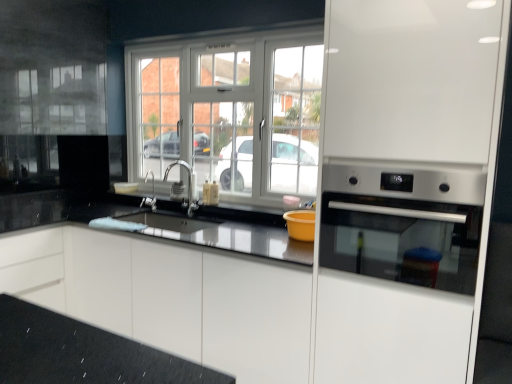
Question: Is white glossy cabinet at center further to the viewer compared to satin silver oven at right?

Choices:
 (A) yes
 (B) no

Answer: (A)

Question: From a real-world perspective, is white glossy cabinet at center physically below satin silver oven at right?

Choices:
 (A) yes
 (B) no

Answer: (A)

Question: Is white glossy cabinet at center at the left side of satin silver oven at right?

Choices:
 (A) yes
 (B) no

Answer: (A)

Question: From the image's perspective, would you say white glossy cabinet at center is shown under satin silver oven at right?

Choices:
 (A) yes
 (B) no

Answer: (A)

Question: Is white glossy cabinet at center directly adjacent to satin silver oven at right?

Choices:
 (A) no
 (B) yes

Answer: (A)

Question: Is white glossy cabinet at center completely or partially outside of satin silver oven at right?

Choices:
 (A) yes
 (B) no

Answer: (A)

Question: Is the depth of satin nickel faucet at center greater than that of stainless steel oven at right?

Choices:
 (A) no
 (B) yes

Answer: (B)

Question: Is satin nickel faucet at center far from stainless steel oven at right?

Choices:
 (A) no
 (B) yes

Answer: (B)

Question: Could you tell me if satin nickel faucet at center is facing stainless steel oven at right?

Choices:
 (A) yes
 (B) no

Answer: (B)

Question: Does satin nickel faucet at center appear on the right side of stainless steel oven at right?

Choices:
 (A) no
 (B) yes

Answer: (A)

Question: From a real-world perspective, is satin nickel faucet at center beneath stainless steel oven at right?

Choices:
 (A) yes
 (B) no

Answer: (A)

Question: Considering the relative sizes of satin nickel faucet at center and stainless steel oven at right in the image provided, is satin nickel faucet at center taller than stainless steel oven at right?

Choices:
 (A) yes
 (B) no

Answer: (B)

Question: Is satin nickel faucet at center positioned with its back to satin nickel faucet at center?

Choices:
 (A) yes
 (B) no

Answer: (B)